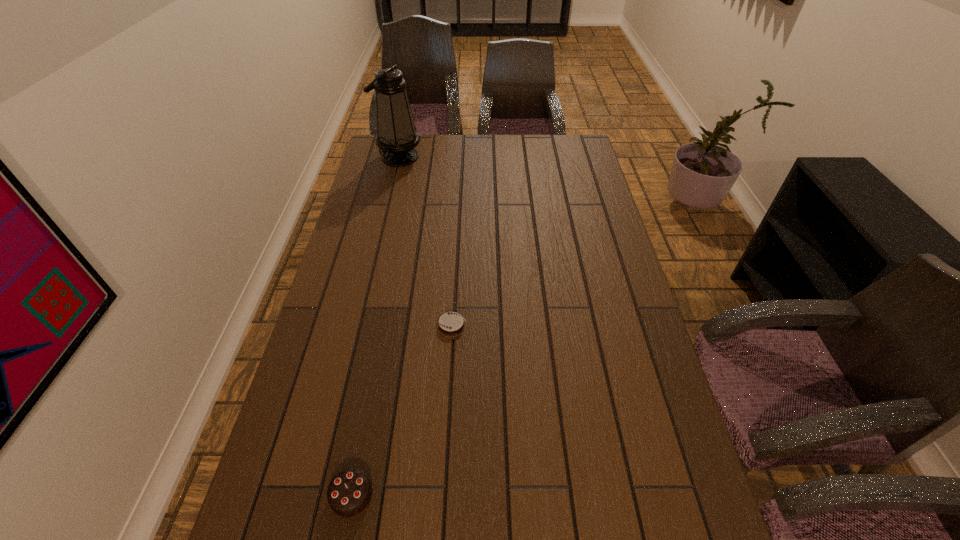
Image resolution: width=960 pixels, height=540 pixels. Find the location of `blank area in the image that satisfies the following two spatial constraints: 1. on the back side of the nearer chocolate cake; 2. on the right side of the rightmost object`. blank area in the image that satisfies the following two spatial constraints: 1. on the back side of the nearer chocolate cake; 2. on the right side of the rightmost object is located at coordinates (384, 325).

Identify the location of free location that satisfies the following two spatial constraints: 1. on the front side of the oil lamp; 2. on the right side of the taller chocolate cake. The width and height of the screenshot is (960, 540). (318, 495).

What are the coordinates of `free space that satisfies the following two spatial constraints: 1. on the front side of the oil lamp; 2. on the right side of the shorter chocolate cake` in the screenshot? It's located at (359, 325).

The height and width of the screenshot is (540, 960). I want to click on vacant space that satisfies the following two spatial constraints: 1. on the front side of the farthest object; 2. on the right side of the second tallest object, so click(x=318, y=495).